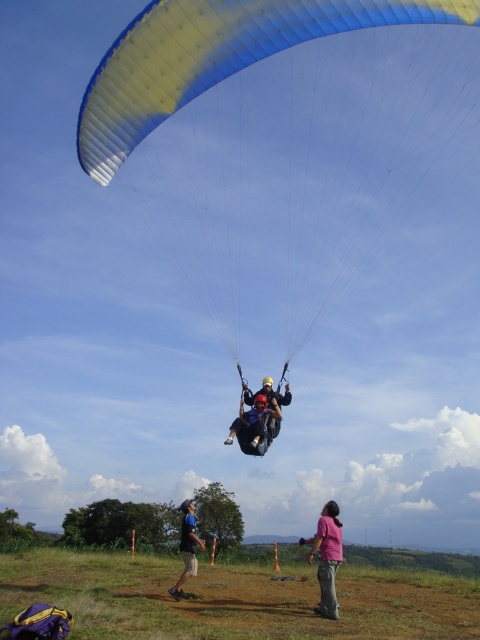
You are standing on the grassy field and see the point marked at coordinates [280,132]. What object is located at that point?

The point at coordinates [280,132] indicates the blue and yellow fabric parachute at upper center.